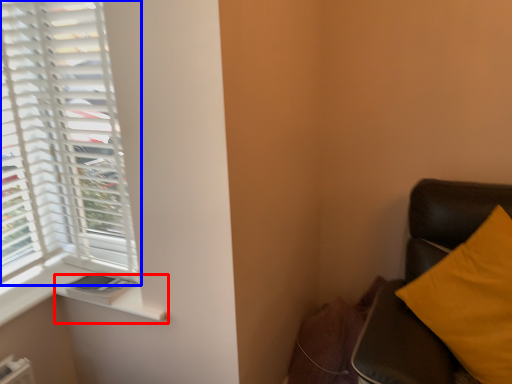
Question: Which point is further to the camera, window sill (highlighted by a red box) or window (highlighted by a blue box)?

Choices:
 (A) window sill
 (B) window

Answer: (A)